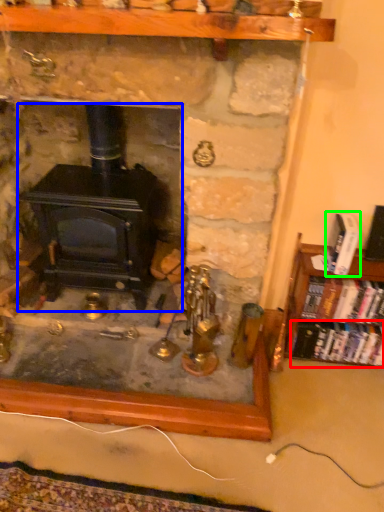
Question: Which is nearer to the book (highlighted by a red box)? wood burning stove (highlighted by a blue box) or book (highlighted by a green box).

Choices:
 (A) wood burning stove
 (B) book

Answer: (B)